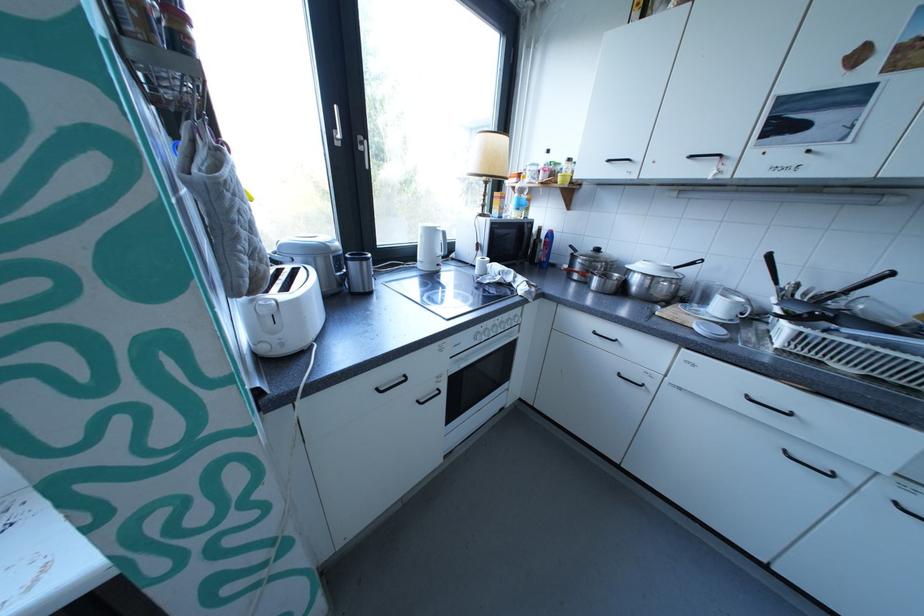
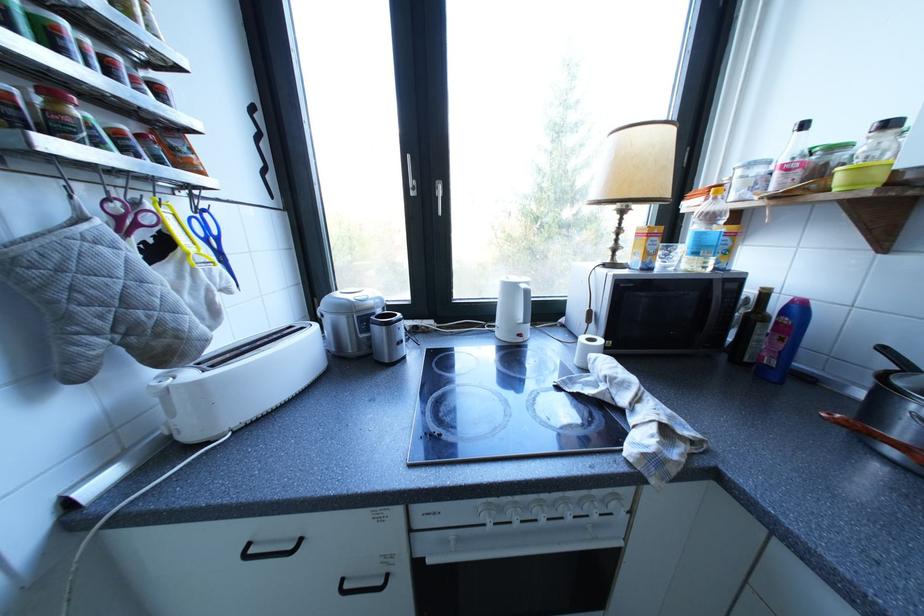
In the second image, find the point that corresponds to point 589,277 in the first image.

(907, 454)